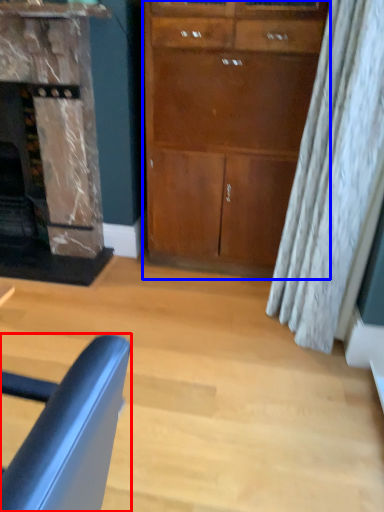
Question: Which object appears closest to the camera in this image, chair (highlighted by a red box) or cabinetry (highlighted by a blue box)?

Choices:
 (A) chair
 (B) cabinetry

Answer: (A)